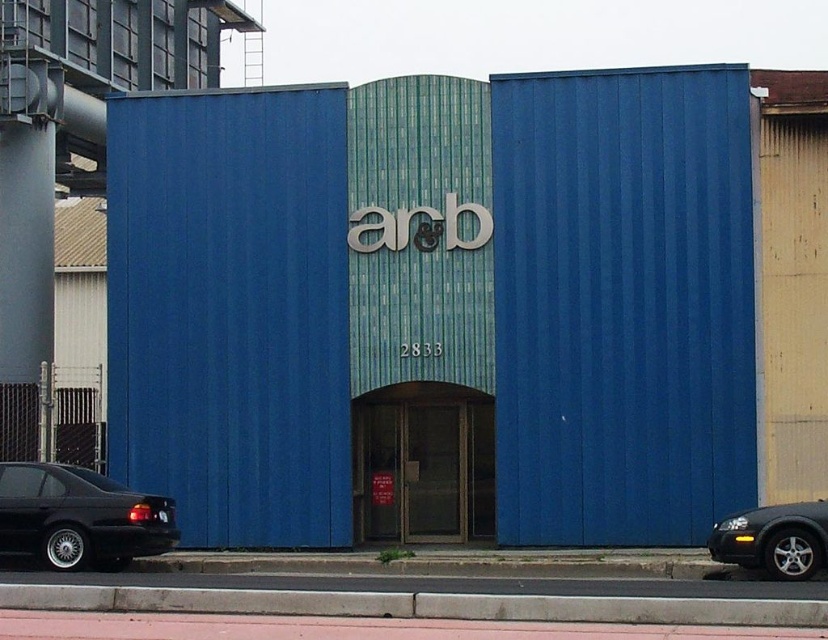
Which is behind, point (822, 602) or point (83, 500)?

Point (83, 500)

Can you confirm if pink rubber curb at lower center is positioned below black matte sedan at lower left?

Indeed, pink rubber curb at lower center is positioned under black matte sedan at lower left.

Is point (623, 604) closer to viewer compared to point (100, 493)?

Yes.

The height and width of the screenshot is (640, 828). In order to click on pink rubber curb at lower center in this screenshot , I will do `click(417, 604)`.

Is pink rubber curb at lower center to the right of shiny silver sedan at lower right from the viewer's perspective?

No, pink rubber curb at lower center is not to the right of shiny silver sedan at lower right.

In order to click on pink rubber curb at lower center in this screenshot , I will do `click(417, 604)`.

Does black matte sedan at lower left have a lesser height compared to shiny silver sedan at lower right?

No.

Who is shorter, black matte sedan at lower left or shiny silver sedan at lower right?

shiny silver sedan at lower right is shorter.

Who is more distant from viewer, (35, 481) or (753, 544)?

The point (35, 481) is behind.

You are a GUI agent. You are given a task and a screenshot of the screen. Output one action in this format:
    pyautogui.click(x=<x>, y=<y>)
    Task: Click on the black matte sedan at lower left
    
    Given the screenshot: What is the action you would take?
    pyautogui.click(x=79, y=516)